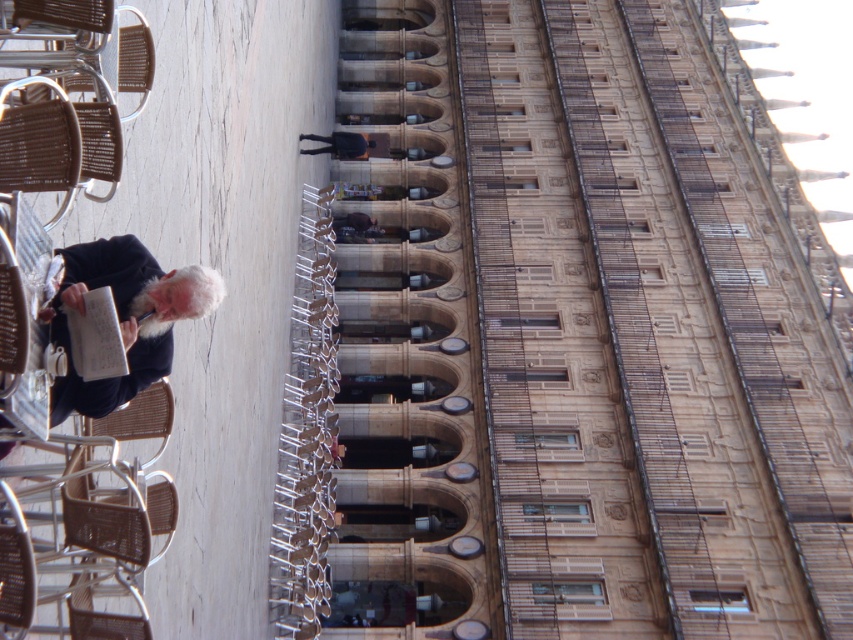
Is dark blue fabric at lower left below brown woven chair at lower left?

Incorrect, dark blue fabric at lower left is not positioned below brown woven chair at lower left.

Does dark blue fabric at lower left have a lesser height compared to brown woven chair at lower left?

No.

Is point (74, 378) positioned before point (154, 419)?

Yes.

The image size is (853, 640). I want to click on dark blue fabric at lower left, so click(125, 317).

Which is behind, point (74, 492) or point (172, 401)?

Positioned behind is point (172, 401).

Does woven brown chair at lower left have a lesser width compared to brown woven chair at lower left?

In fact, woven brown chair at lower left might be wider than brown woven chair at lower left.

Where is `woven brown chair at lower left`? The width and height of the screenshot is (853, 640). woven brown chair at lower left is located at coordinates (119, 513).

Which of these two, dark blue fabric at lower left or woven brown chair at lower left, stands taller?

dark blue fabric at lower left is taller.

This screenshot has width=853, height=640. Describe the element at coordinates (125, 317) in the screenshot. I see `dark blue fabric at lower left` at that location.

I want to click on dark blue fabric at lower left, so click(125, 317).